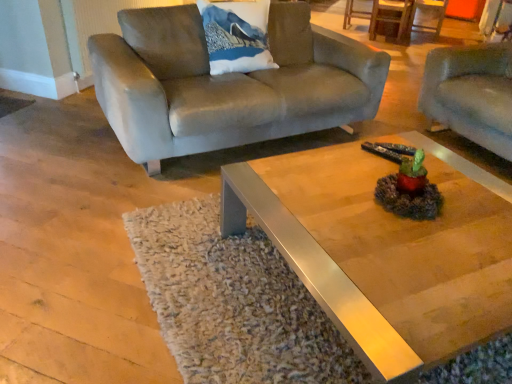
Question: From the image's perspective, does suede-like gray couch at right, placed as the 1th studio couch when sorted from right to left, appear lower than metallic polished coffee table at center?

Choices:
 (A) no
 (B) yes

Answer: (A)

Question: From the image's perspective, is suede-like gray couch at right, which is the 2th studio couch from left to right, on metallic polished coffee table at center?

Choices:
 (A) no
 (B) yes

Answer: (B)

Question: From a real-world perspective, is suede-like gray couch at right, which is the 2th studio couch from left to right, on metallic polished coffee table at center?

Choices:
 (A) yes
 (B) no

Answer: (A)

Question: Is suede-like gray couch at right, which is the 2th studio couch from left to right, positioned before metallic polished coffee table at center?

Choices:
 (A) yes
 (B) no

Answer: (B)

Question: Is suede-like gray couch at right, placed as the 1th studio couch when sorted from right to left, next to metallic polished coffee table at center?

Choices:
 (A) no
 (B) yes

Answer: (A)

Question: From the image's perspective, relative to white fabric pillow with mountain print at upper center, is suede couch at upper left, which ranks as the first studio couch in left-to-right order, above or below?

Choices:
 (A) below
 (B) above

Answer: (A)

Question: In terms of width, does suede couch at upper left, which ranks as the first studio couch in left-to-right order, look wider or thinner when compared to white fabric pillow with mountain print at upper center?

Choices:
 (A) wide
 (B) thin

Answer: (A)

Question: Is suede couch at upper left, which ranks as the first studio couch in left-to-right order, taller or shorter than white fabric pillow with mountain print at upper center?

Choices:
 (A) short
 (B) tall

Answer: (B)

Question: Based on their sizes in the image, would you say suede couch at upper left, which ranks as the first studio couch in left-to-right order, is bigger or smaller than white fabric pillow with mountain print at upper center?

Choices:
 (A) small
 (B) big

Answer: (B)

Question: Would you say metallic polished coffee table at center is inside or outside suede-like gray couch at right, placed as the 1th studio couch when sorted from right to left?

Choices:
 (A) inside
 (B) outside

Answer: (B)

Question: Does point (449, 334) appear closer or farther from the camera than point (505, 79)?

Choices:
 (A) closer
 (B) farther

Answer: (A)

Question: Is metallic polished coffee table at center wider or thinner than suede-like gray couch at right, placed as the 1th studio couch when sorted from right to left?

Choices:
 (A) thin
 (B) wide

Answer: (B)

Question: From the image's perspective, relative to suede-like gray couch at right, placed as the 1th studio couch when sorted from right to left, is metallic polished coffee table at center above or below?

Choices:
 (A) below
 (B) above

Answer: (A)

Question: Is white fabric pillow with mountain print at upper center taller or shorter than metallic polished coffee table at center?

Choices:
 (A) tall
 (B) short

Answer: (A)

Question: In terms of size, does white fabric pillow with mountain print at upper center appear bigger or smaller than metallic polished coffee table at center?

Choices:
 (A) small
 (B) big

Answer: (B)